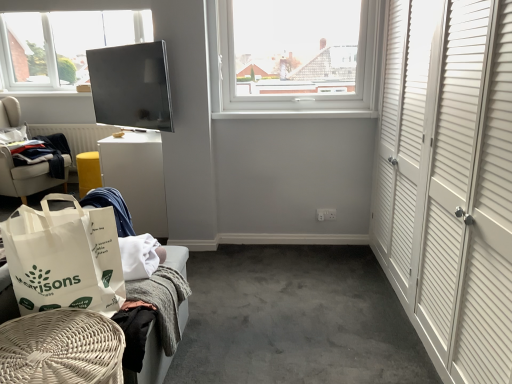
Question: Is white wicker basket at lower left, the 1th furniture in the right-to-left sequence, positioned far away from white paper bag at lower left?

Choices:
 (A) no
 (B) yes

Answer: (A)

Question: Is white wicker basket at lower left, placed as the third furniture when sorted from left to right, taller than white paper bag at lower left?

Choices:
 (A) no
 (B) yes

Answer: (A)

Question: Would you say white wicker basket at lower left, the 1th furniture in the right-to-left sequence, is outside white paper bag at lower left?

Choices:
 (A) no
 (B) yes

Answer: (B)

Question: From a real-world perspective, is white wicker basket at lower left, acting as the third furniture starting from the back, physically above white paper bag at lower left?

Choices:
 (A) no
 (B) yes

Answer: (A)

Question: Does white wicker basket at lower left, which is counted as the first furniture, starting from the front, lie behind white paper bag at lower left?

Choices:
 (A) yes
 (B) no

Answer: (B)

Question: In terms of size, does white glossy table at center-left, the 2th table positioned from the left, appear bigger or smaller than white wicker basket at lower left, the 1th furniture in the right-to-left sequence?

Choices:
 (A) small
 (B) big

Answer: (B)

Question: From the image's perspective, relative to white wicker basket at lower left, the 1th furniture in the right-to-left sequence, is white glossy table at center-left, which is the 2th table from back to front, above or below?

Choices:
 (A) above
 (B) below

Answer: (A)

Question: Is point (161, 185) closer or farther from the camera than point (46, 314)?

Choices:
 (A) farther
 (B) closer

Answer: (A)

Question: From a real-world perspective, relative to white wicker basket at lower left, which is counted as the first furniture, starting from the front, is white glossy table at center-left, the 2th table positioned from the left, vertically above or below?

Choices:
 (A) below
 (B) above

Answer: (A)

Question: Is white fabric chair at left, which ranks as the third furniture in right-to-left order, situated inside white woven basket at lower left, marked as the 2th furniture in a front-to-back arrangement, or outside?

Choices:
 (A) inside
 (B) outside

Answer: (B)

Question: Looking at the image, does white fabric chair at left, which ranks as the third furniture in right-to-left order, seem bigger or smaller compared to white woven basket at lower left, positioned as the second furniture in top-to-bottom order?

Choices:
 (A) big
 (B) small

Answer: (A)

Question: From their relative heights in the image, would you say white fabric chair at left, which ranks as the third furniture in right-to-left order, is taller or shorter than white woven basket at lower left, the 2th furniture from the left?

Choices:
 (A) tall
 (B) short

Answer: (A)

Question: Is point (48, 168) closer or farther from the camera than point (184, 264)?

Choices:
 (A) farther
 (B) closer

Answer: (A)

Question: From the image's perspective, is dark blue fabric at left above or below white fabric chair at left, the third furniture in the front-to-back sequence?

Choices:
 (A) below
 (B) above

Answer: (A)

Question: Is dark blue fabric at left bigger or smaller than white fabric chair at left, placed as the third furniture when sorted from bottom to top?

Choices:
 (A) small
 (B) big

Answer: (A)